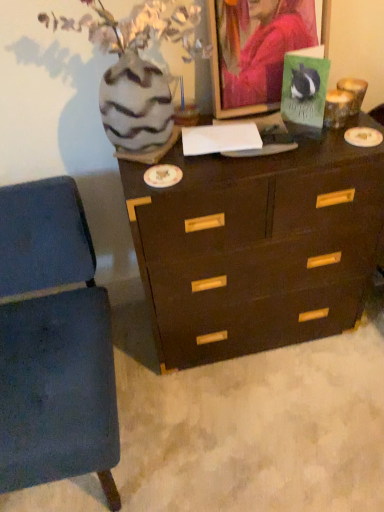
Question: Considering their positions, is matte green card at upper center located in front of or behind blue fabric chair at lower left?

Choices:
 (A) behind
 (B) front

Answer: (A)

Question: Considering the positions of matte green card at upper center and blue fabric chair at lower left in the image, is matte green card at upper center wider or thinner than blue fabric chair at lower left?

Choices:
 (A) thin
 (B) wide

Answer: (A)

Question: Estimate the real-world distances between objects in this image. Which object is closer to the speckled ceramic vase at upper left?

Choices:
 (A) dark wood chest of drawers at center
 (B) green matte postcard at upper right
 (C) blue fabric chair at lower left
 (D) matte green card at upper center

Answer: (D)

Question: Estimate the real-world distances between objects in this image. Which object is farther from the blue fabric chair at lower left?

Choices:
 (A) speckled ceramic vase at upper left
 (B) dark wood chest of drawers at center
 (C) green matte postcard at upper right
 (D) matte green card at upper center

Answer: (C)